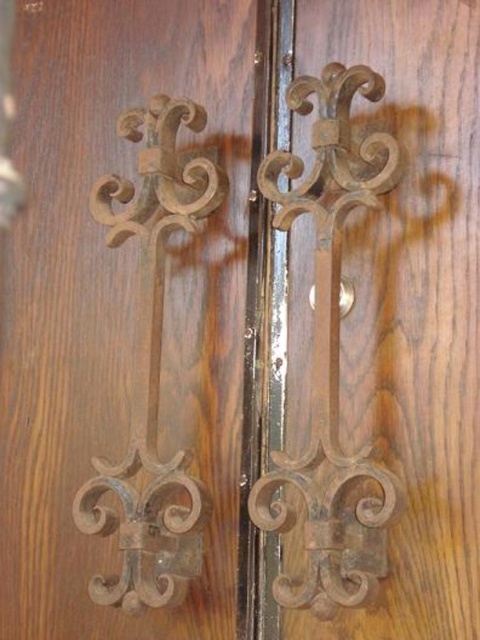
Is rusty metal door handle at center wider than brown wrought iron at left?

Incorrect, rusty metal door handle at center's width does not surpass brown wrought iron at left's.

Is rusty metal door handle at center further to the viewer compared to brown wrought iron at left?

No, it is in front of brown wrought iron at left.

Describe the element at coordinates (328, 349) in the screenshot. Image resolution: width=480 pixels, height=640 pixels. I see `rusty metal door handle at center` at that location.

Locate an element on the screen. The image size is (480, 640). rusty metal door handle at center is located at coordinates (328, 349).